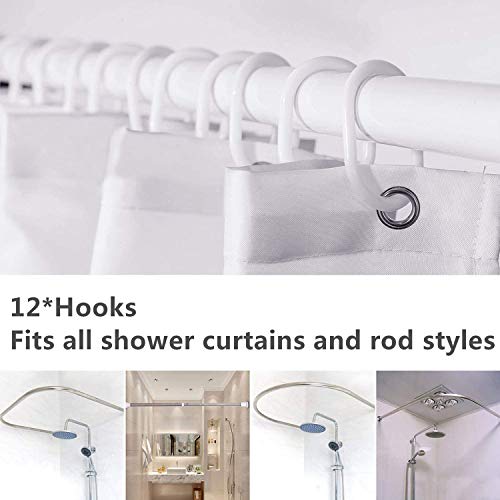
Locate an element on the screen. The image size is (500, 500). hook is located at coordinates (36, 91).